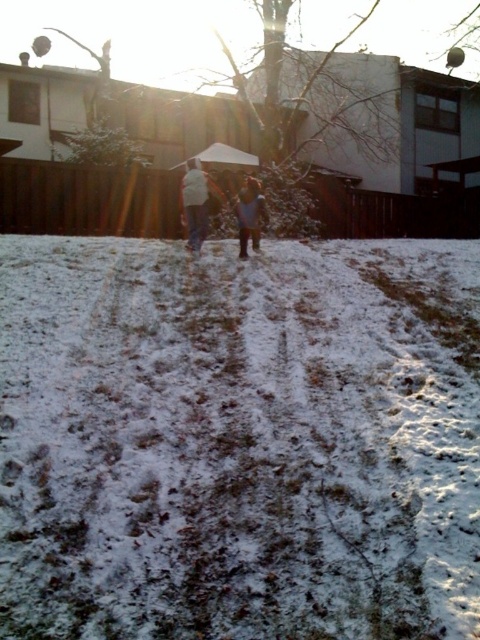
Is white powdery snow at center positioned before blue denim jeans at center?

Yes, white powdery snow at center is in front of blue denim jeans at center.

Who is lower down, white powdery snow at center or blue denim jeans at center?

white powdery snow at center

Who is more forward, (x=431, y=420) or (x=240, y=237)?

Point (x=431, y=420)

Find the location of `white powdery snow at center`. white powdery snow at center is located at coordinates (239, 440).

Consider the image. Does white powdery snow at center have a greater height compared to white matte jacket at center?

Indeed, white powdery snow at center has a greater height compared to white matte jacket at center.

Is point (96, 404) positioned before point (189, 246)?

Yes, it is in front of point (189, 246).

Locate an element on the screen. The image size is (480, 640). white powdery snow at center is located at coordinates (239, 440).

I want to click on blue denim jeans at center, so click(x=250, y=216).

Can you confirm if blue denim jeans at center is positioned to the right of white matte umbrella at center?

Indeed, blue denim jeans at center is positioned on the right side of white matte umbrella at center.

Where is `blue denim jeans at center`? Image resolution: width=480 pixels, height=640 pixels. blue denim jeans at center is located at coordinates (250, 216).

At what (x,y) coordinates should I click in order to perform the action: click on blue denim jeans at center. Please return your answer as a coordinate pair (x, y). The image size is (480, 640). Looking at the image, I should click on (250, 216).